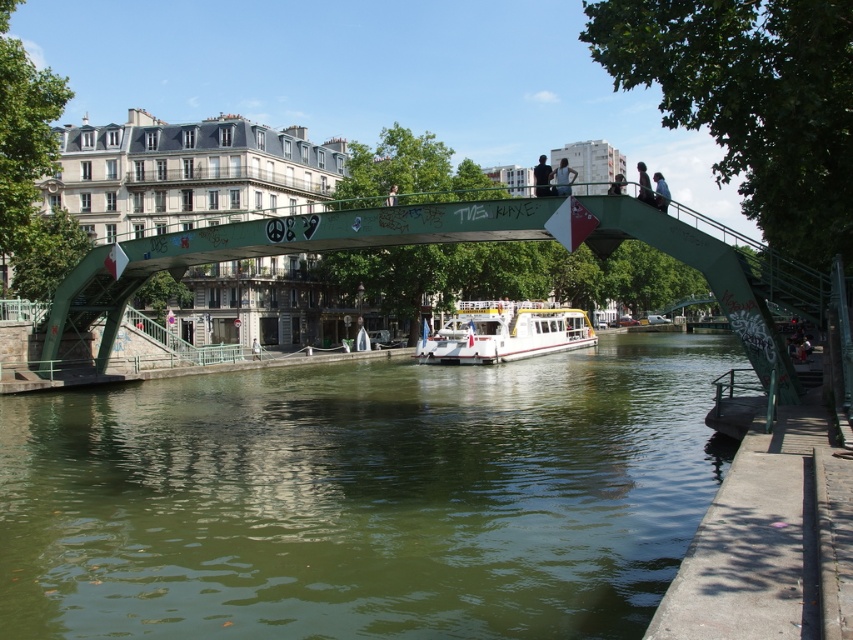
Does green water at center have a greater width compared to green painted metal pedestrian bridge at center?

Correct, the width of green water at center exceeds that of green painted metal pedestrian bridge at center.

Is point (190, 612) less distant than point (199, 232)?

Yes, it is in front of point (199, 232).

Find the location of `green water at center`. green water at center is located at coordinates pyautogui.click(x=363, y=497).

Can you confirm if green painted metal pedestrian bridge at center is shorter than dark blue jeans at upper center?

Correct, green painted metal pedestrian bridge at center is not as tall as dark blue jeans at upper center.

Is point (496, 230) positioned after point (645, 198)?

That is True.

You are a GUI agent. You are given a task and a screenshot of the screen. Output one action in this format:
    pyautogui.click(x=<x>, y=<y>)
    Task: Click on the green painted metal pedestrian bridge at center
    This screenshot has height=640, width=853.
    Given the screenshot: What is the action you would take?
    tap(277, 250)

Is green painted metal pedestrian bridge at center to the left of light blue shirt at upper center from the viewer's perspective?

Correct, you'll find green painted metal pedestrian bridge at center to the left of light blue shirt at upper center.

Between green painted metal pedestrian bridge at center and light blue shirt at upper center, which one is positioned lower?

Positioned lower is green painted metal pedestrian bridge at center.

I want to click on green painted metal pedestrian bridge at center, so click(x=277, y=250).